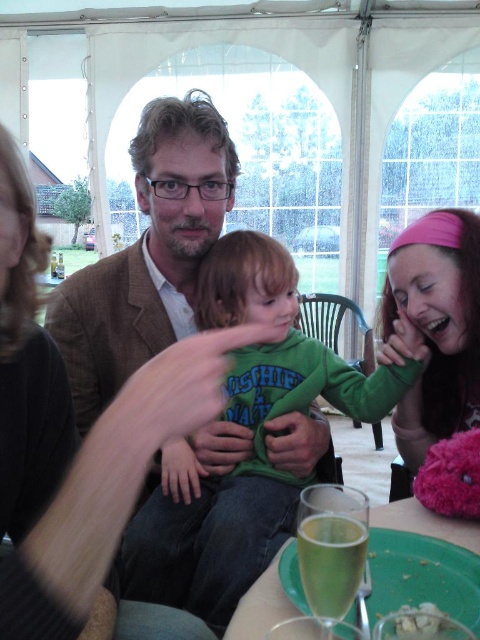
Which is in front, point (437, 352) or point (381, 528)?

Point (381, 528) is more forward.

Who is shorter, pink fabric headband at lower right or green plastic plate at lower center?

green plastic plate at lower center is shorter.

Who is more distant from viewer, (446, 301) or (287, 605)?

The point (446, 301) is behind.

You are a GUI agent. You are given a task and a screenshot of the screen. Output one action in this format:
    pyautogui.click(x=<x>, y=<y>)
    Task: Click on the pink fabric headband at lower right
    The image size is (480, 640).
    Given the screenshot: What is the action you would take?
    pyautogui.click(x=434, y=326)

Which of these two, green cotton shirt at center or pink fabric headband at lower right, stands shorter?

pink fabric headband at lower right

Between point (419, 364) and point (434, 227), which one is positioned behind?

The point (419, 364) is more distant.

Where is `green cotton shirt at center`? green cotton shirt at center is located at coordinates (253, 440).

Which is more to the right, green cotton shirt at center or green plastic plate at lower center?

From the viewer's perspective, green plastic plate at lower center appears more on the right side.

Does green cotton shirt at center appear on the left side of green plastic plate at lower center?

Correct, you'll find green cotton shirt at center to the left of green plastic plate at lower center.

Locate an element on the screen. green cotton shirt at center is located at coordinates (253, 440).